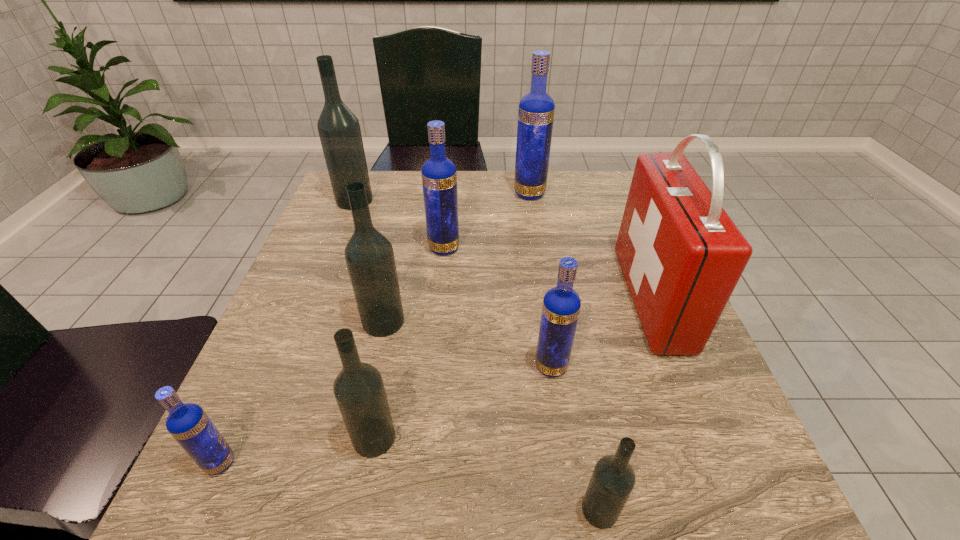
Where is `vacant space that is in between the second farthest blue vodka and the first-aid kit`? The width and height of the screenshot is (960, 540). vacant space that is in between the second farthest blue vodka and the first-aid kit is located at coordinates (548, 273).

The height and width of the screenshot is (540, 960). In order to click on free space that is in between the first-aid kit and the farthest blue vodka in this screenshot , I will do `click(590, 246)`.

Image resolution: width=960 pixels, height=540 pixels. I want to click on free space between the fourth vodka from right to left and the farthest blue vodka, so click(487, 221).

Identify which object is the fifth closest to the leftmost blue vodka. Please provide its 2D coordinates. Your answer should be formatted as a tuple, i.e. [(x, y)], where the tuple contains the x and y coordinates of a point satisfying the conditions above.

[(439, 177)]

Point out which object is positioned as the fifth nearest to the farthest blue vodka. Please provide its 2D coordinates. Your answer should be formatted as a tuple, i.e. [(x, y)], where the tuple contains the x and y coordinates of a point satisfying the conditions above.

[(561, 305)]

Select which vodka appears as the seventh closest to the third nearest blue vodka. Please provide its 2D coordinates. Your answer should be formatted as a tuple, i.e. [(x, y)], where the tuple contains the x and y coordinates of a point satisfying the conditions above.

[(613, 479)]

Identify which vodka is located as the third nearest to the third biggest black vodka. Please provide its 2D coordinates. Your answer should be formatted as a tuple, i.e. [(x, y)], where the tuple contains the x and y coordinates of a point satisfying the conditions above.

[(561, 305)]

Select which blue vodka is the second closest to the leftmost blue vodka. Please provide its 2D coordinates. Your answer should be formatted as a tuple, i.e. [(x, y)], where the tuple contains the x and y coordinates of a point satisfying the conditions above.

[(439, 177)]

This screenshot has height=540, width=960. In order to click on blue vodka that is the third closest one to the third biggest blue vodka in this screenshot , I will do `click(536, 110)`.

Select which black vodka appears as the third closest to the second smallest black vodka. Please provide its 2D coordinates. Your answer should be formatted as a tuple, i.e. [(x, y)], where the tuple contains the x and y coordinates of a point satisfying the conditions above.

[(339, 130)]